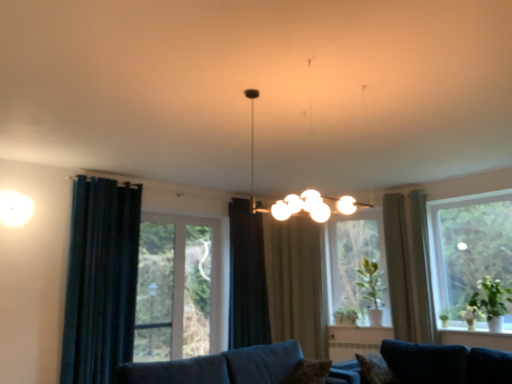
Question: Which direction should I rotate to look at clear glass window at center, which is the 2th window from right to left?

Choices:
 (A) right
 (B) left

Answer: (A)

Question: Does clear glass window at center, placed as the 1th window when sorted from left to right, touch clear glass window at center, positioned as the 2th window in left-to-right order?

Choices:
 (A) yes
 (B) no

Answer: (B)

Question: Is clear glass window at center, positioned as the 2th window in left-to-right order, located within clear glass window at center, placed as the 1th window when sorted from left to right?

Choices:
 (A) yes
 (B) no

Answer: (B)

Question: Can you confirm if clear glass window at center, the 3th window positioned from the right, is shorter than clear glass window at center, which is the 2th window from right to left?

Choices:
 (A) no
 (B) yes

Answer: (A)

Question: Can you confirm if clear glass window at center, the 3th window positioned from the right, is wider than clear glass window at center, which is the 2th window from right to left?

Choices:
 (A) yes
 (B) no

Answer: (B)

Question: Considering the relative positions of clear glass window at center, placed as the 1th window when sorted from left to right, and clear glass window at center, positioned as the 2th window in left-to-right order, in the image provided, is clear glass window at center, placed as the 1th window when sorted from left to right, to the right of clear glass window at center, positioned as the 2th window in left-to-right order, from the viewer's perspective?

Choices:
 (A) no
 (B) yes

Answer: (A)

Question: Is clear glass window at center, placed as the 1th window when sorted from left to right, smaller than clear glass window at center, positioned as the 2th window in left-to-right order?

Choices:
 (A) no
 (B) yes

Answer: (B)

Question: From a real-world perspective, is beige fabric curtain at right, the fifth curtain when ordered from left to right, on beige fabric curtain at center, which is the 3th curtain from right to left?

Choices:
 (A) yes
 (B) no

Answer: (A)

Question: From a real-world perspective, is beige fabric curtain at right, the fifth curtain when ordered from left to right, under beige fabric curtain at center, which is the 3th curtain in left-to-right order?

Choices:
 (A) no
 (B) yes

Answer: (A)

Question: Is beige fabric curtain at right, the fifth curtain when ordered from left to right, to the left of beige fabric curtain at center, which is the 3th curtain from right to left, from the viewer's perspective?

Choices:
 (A) no
 (B) yes

Answer: (A)

Question: Can you confirm if beige fabric curtain at right, the fifth curtain when ordered from left to right, is smaller than beige fabric curtain at center, which is the 3th curtain in left-to-right order?

Choices:
 (A) no
 (B) yes

Answer: (B)

Question: Considering the relative sizes of beige fabric curtain at right, the fifth curtain when ordered from left to right, and beige fabric curtain at center, which is the 3th curtain in left-to-right order, in the image provided, is beige fabric curtain at right, the fifth curtain when ordered from left to right, bigger than beige fabric curtain at center, which is the 3th curtain in left-to-right order,?

Choices:
 (A) no
 (B) yes

Answer: (A)

Question: Would you say beige fabric curtain at right, the fifth curtain when ordered from left to right, is outside beige fabric curtain at center, which is the 3th curtain in left-to-right order?

Choices:
 (A) no
 (B) yes

Answer: (B)

Question: From a real-world perspective, is green leafy plant at right, marked as the first plant in a right-to-left arrangement, positioned over green leafy plant at lower center, positioned as the 1th plant in left-to-right order, based on gravity?

Choices:
 (A) no
 (B) yes

Answer: (B)